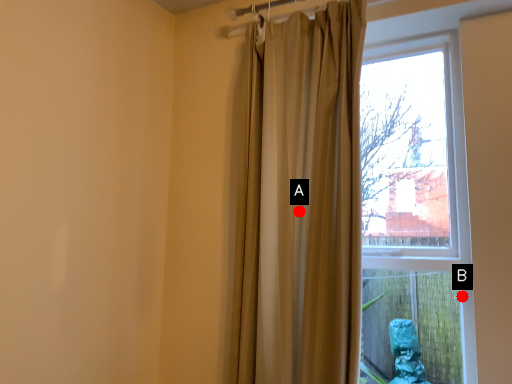
Question: Two points are circled on the image, labeled by A and B beside each circle. Which point is closer to the camera?

Choices:
 (A) A is closer
 (B) B is closer

Answer: (A)